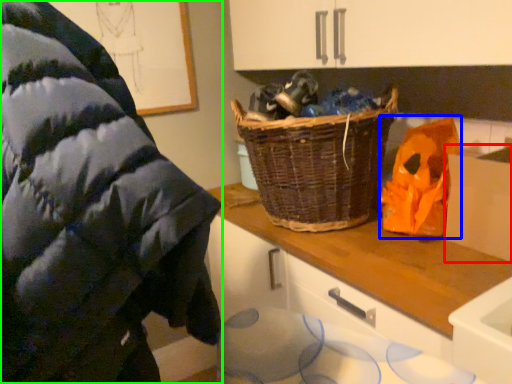
Question: Considering the real-world distances, which object is closest to cardboard box (highlighted by a red box)? waste (highlighted by a blue box) or wool (highlighted by a green box).

Choices:
 (A) waste
 (B) wool

Answer: (A)